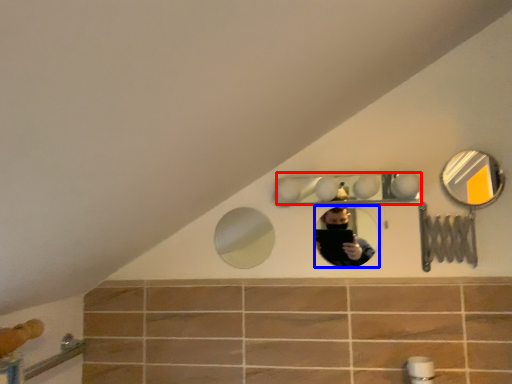
Question: Which point is closer to the camera, mirror (highlighted by a red box) or mirror (highlighted by a blue box)?

Choices:
 (A) mirror
 (B) mirror

Answer: (A)